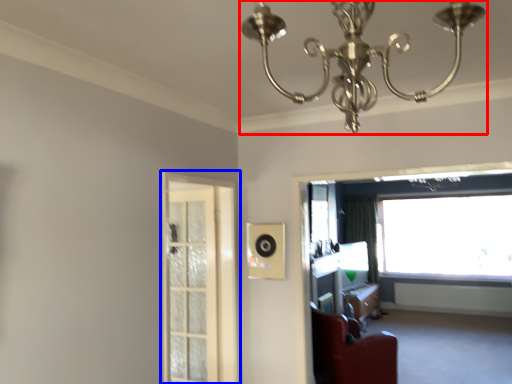
Question: Among these objects, which one is farthest to the camera, lamp (highlighted by a red box) or screen door (highlighted by a blue box)?

Choices:
 (A) lamp
 (B) screen door

Answer: (B)